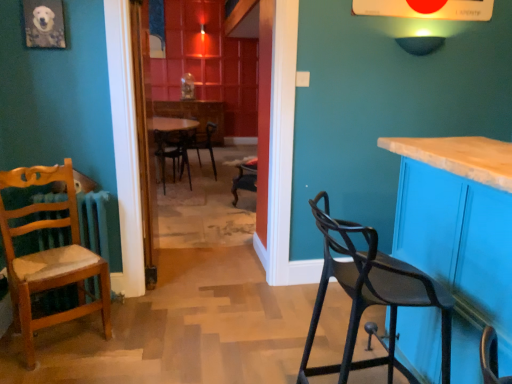
This screenshot has height=384, width=512. In order to click on spots to the right of wooden chair with cushion at left, positioned as the second chair in front-to-back order in this screenshot , I will do point(135,332).